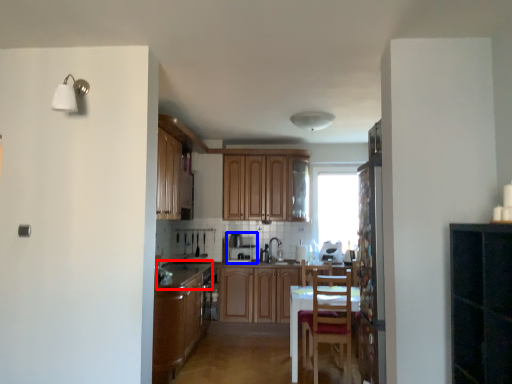
Question: Which object is closer to the camera taking this photo, counter top (highlighted by a red box) or appliance (highlighted by a blue box)?

Choices:
 (A) counter top
 (B) appliance

Answer: (A)